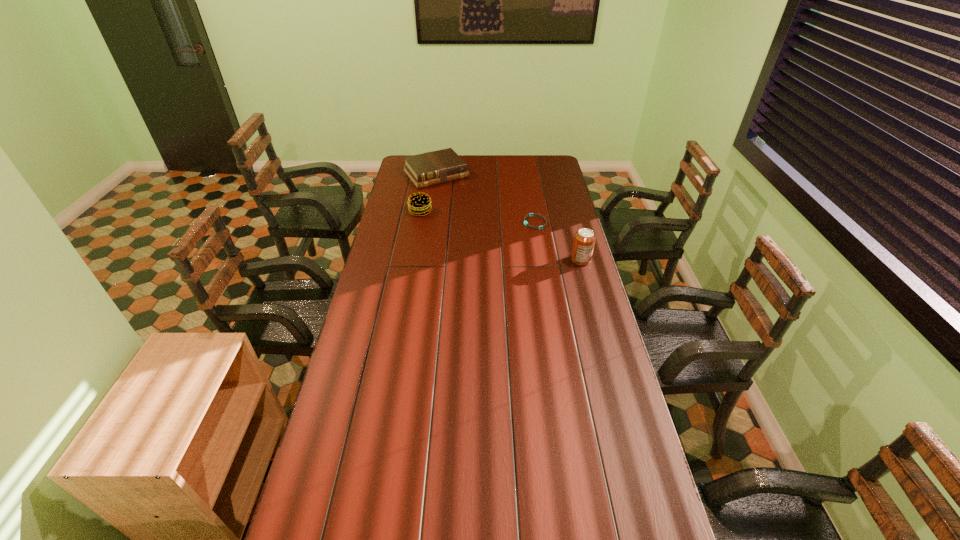
Where is `vacant region between the wristband and the can`? vacant region between the wristband and the can is located at coordinates (558, 241).

You are a GUI agent. You are given a task and a screenshot of the screen. Output one action in this format:
    pyautogui.click(x=<x>, y=<y>)
    Task: Click on the empty space between the shortest object and the can
    Image resolution: width=960 pixels, height=540 pixels.
    Given the screenshot: What is the action you would take?
    click(x=558, y=241)

The height and width of the screenshot is (540, 960). In order to click on empty space between the Bible and the patty in this screenshot , I will do `click(428, 193)`.

Locate an element on the screen. This screenshot has width=960, height=540. vacant point located between the Bible and the shortest object is located at coordinates (486, 198).

This screenshot has width=960, height=540. What are the coordinates of `object that is the third closest to the third object from left to right` in the screenshot? It's located at (419, 204).

Identify which object is the second nearest to the Bible. Please provide its 2D coordinates. Your answer should be formatted as a tuple, i.e. [(x, y)], where the tuple contains the x and y coordinates of a point satisfying the conditions above.

[(530, 214)]

What are the coordinates of `free space that satisfies the following two spatial constraints: 1. on the back side of the farthest object; 2. on the left side of the patty` in the screenshot? It's located at (427, 174).

Find the location of a particular element. The image size is (960, 540). free space in the image that satisfies the following two spatial constraints: 1. on the front side of the patty; 2. on the left side of the wristband is located at coordinates (419, 222).